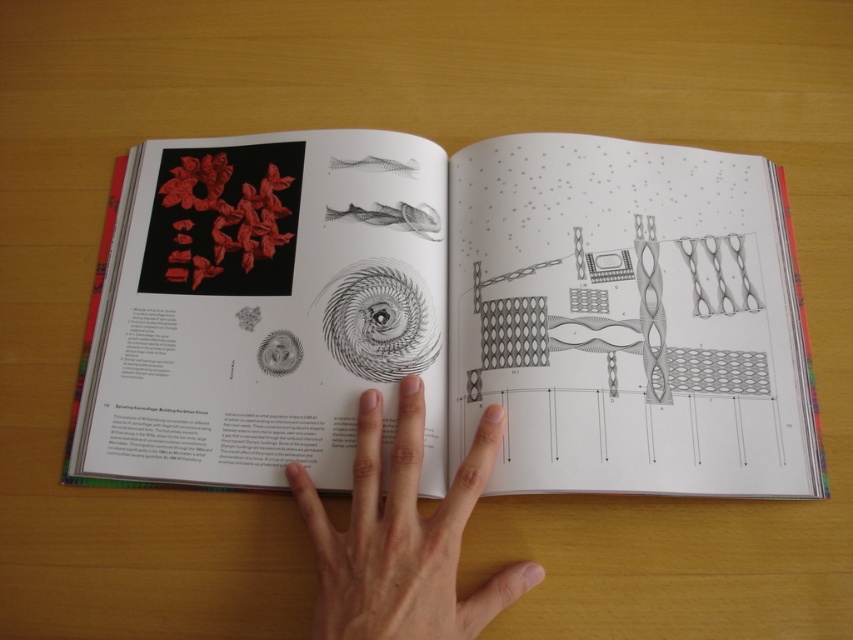
Which of these two, matte black book at center or skinny flesh at center, stands shorter?

skinny flesh at center

Is matte black book at center further to the viewer compared to skinny flesh at center?

Yes, matte black book at center is further from the viewer.

I want to click on matte black book at center, so click(451, 314).

Identify the location of matte black book at center. (451, 314).